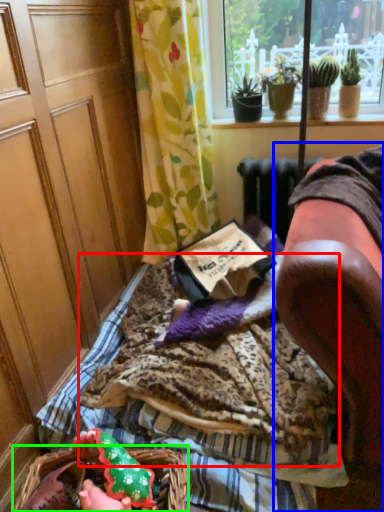
Question: Considering the real-world distances, which object is closest to blanket (highlighted by a red box)? furniture (highlighted by a blue box) or flower basket (highlighted by a green box).

Choices:
 (A) furniture
 (B) flower basket

Answer: (B)